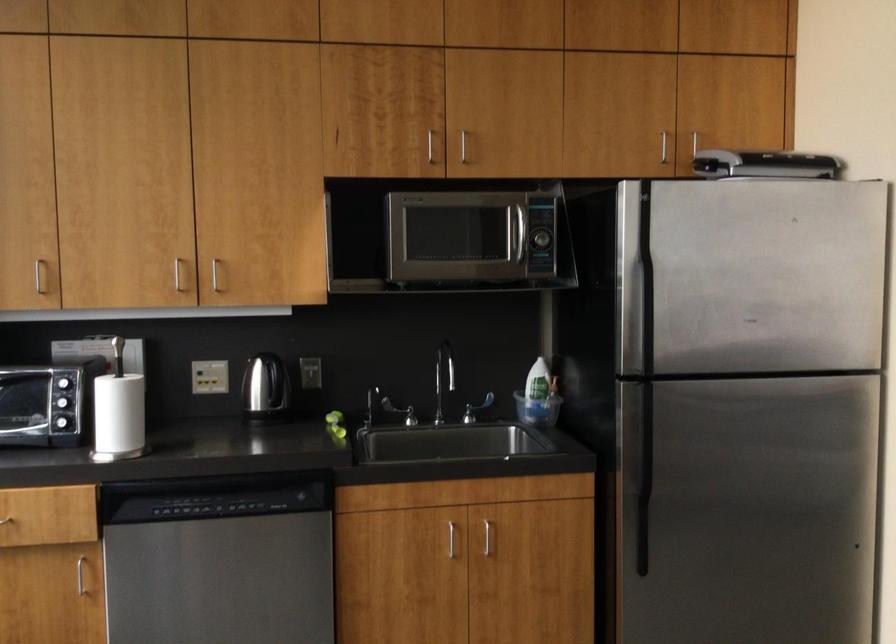
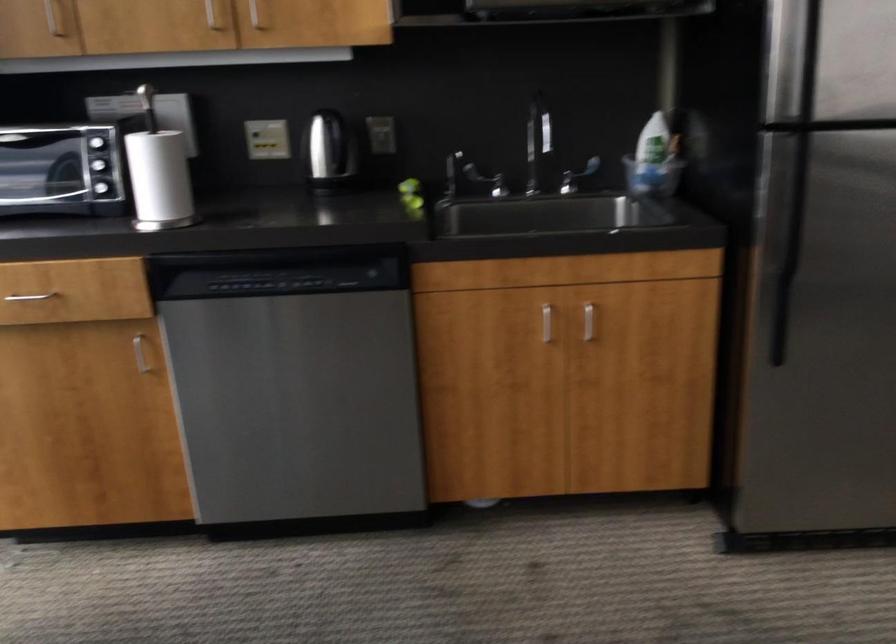
Find the pixel in the second image that matches point 488,538 in the first image.

(588, 321)